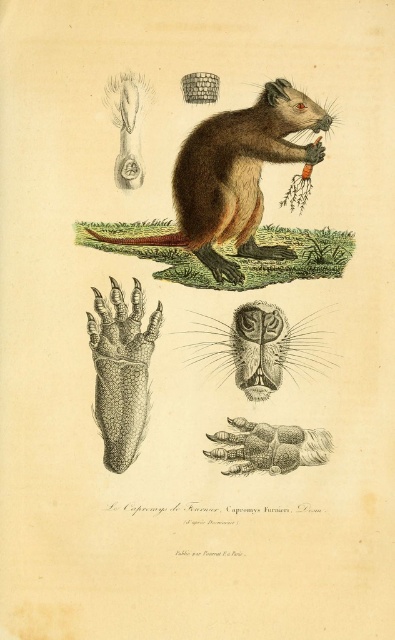
Question: Which object is farther from the camera taking this photo?

Choices:
 (A) smooth brown paw at center
 (B) smooth brown nose at center
 (C) brown furry beaver at center

Answer: (B)

Question: Can you confirm if smooth brown nose at center is positioned to the left of smooth brown paw at center?

Choices:
 (A) yes
 (B) no

Answer: (A)

Question: Which object is closer to the camera taking this photo?

Choices:
 (A) smooth brown paw at center
 (B) brown furry beaver at center

Answer: (A)

Question: Considering the relative positions of smooth brown nose at center and smooth brown paw at center in the image provided, where is smooth brown nose at center located with respect to smooth brown paw at center?

Choices:
 (A) above
 (B) below

Answer: (A)

Question: Does brown furry beaver at center appear on the left side of smooth brown paw at center?

Choices:
 (A) no
 (B) yes

Answer: (B)

Question: Which point is closer to the camera taking this photo?

Choices:
 (A) (205, 125)
 (B) (282, 444)
 (C) (325, 364)

Answer: (B)